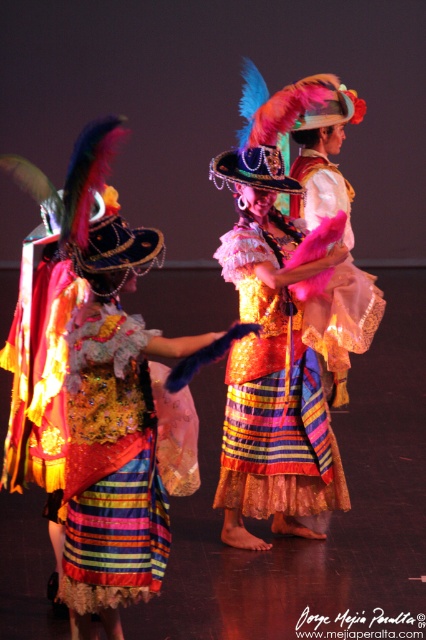
Based on the photo, you are a stagehand measuring the distance between the shiny sequined dress at center and the shiny pink fabric at center for a costume change. The minimum required distance for safe access is 2 meters. Is the current distance sufficient?

The shiny sequined dress at center is 2.13 meters from the shiny pink fabric at center, which exceeds the 2 meter requirement, so the distance is sufficient for safe access.

You are a stagehand trying to adjust the lighting for the performance. You need to ensure that the shiny sequined dress at center and the shiny sequined skirt at center are both illuminated. Since the dress is below the skirt, where should you position the light to best highlight both items?

The shiny sequined dress at center is below the shiny sequined skirt at center. To best highlight both items, position the light above the skirt so that it can illuminate both the skirt and the dress beneath it effectively.

You are a stagehand responsible for ensuring that props and costumes are properly arranged. You notice two items at the center of the stage, the shiny sequined skirt at center and the shiny pink fabric at center. Which item takes up more space on the stage?

The shiny sequined skirt at center has a larger size compared to the shiny pink fabric at center, so it takes up more space on the stage.